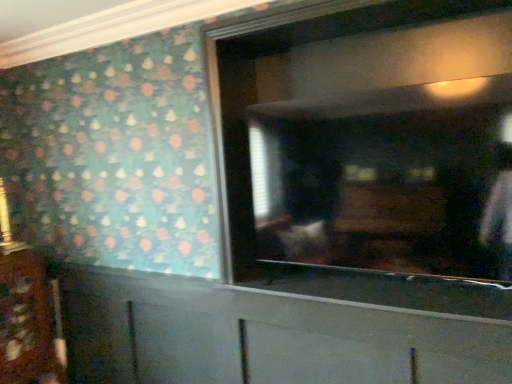
What do you see at coordinates (263, 335) in the screenshot? I see `white matte cabinet at lower center, which is counted as the 1th cabinetry, starting from the right` at bounding box center [263, 335].

This screenshot has height=384, width=512. Describe the element at coordinates (27, 322) in the screenshot. I see `wooden cabinet at lower left, which is counted as the 1th cabinetry, starting from the left` at that location.

Find the location of a particular element. Image resolution: width=512 pixels, height=384 pixels. white matte cabinet at lower center, the second cabinetry when ordered from left to right is located at coordinates (263, 335).

Looking at this image, is wooden cabinet at lower left, marked as the second cabinetry in a right-to-left arrangement, wider than white matte cabinet at lower center, which is counted as the 1th cabinetry, starting from the right?

Indeed, wooden cabinet at lower left, marked as the second cabinetry in a right-to-left arrangement, has a greater width compared to white matte cabinet at lower center, which is counted as the 1th cabinetry, starting from the right.

Considering the sizes of objects wooden cabinet at lower left, marked as the second cabinetry in a right-to-left arrangement, and white matte cabinet at lower center, which is counted as the 1th cabinetry, starting from the right, in the image provided, who is shorter, wooden cabinet at lower left, marked as the second cabinetry in a right-to-left arrangement, or white matte cabinet at lower center, which is counted as the 1th cabinetry, starting from the right,?

Standing shorter between the two is white matte cabinet at lower center, which is counted as the 1th cabinetry, starting from the right.

Does wooden cabinet at lower left, which is counted as the 1th cabinetry, starting from the left, turn towards white matte cabinet at lower center, which is counted as the 1th cabinetry, starting from the right?

Yes, wooden cabinet at lower left, which is counted as the 1th cabinetry, starting from the left, is turned towards white matte cabinet at lower center, which is counted as the 1th cabinetry, starting from the right.

Relative to white matte cabinet at lower center, the second cabinetry when ordered from left to right, is wooden cabinet at lower left, marked as the second cabinetry in a right-to-left arrangement, in front or behind?

Visually, wooden cabinet at lower left, marked as the second cabinetry in a right-to-left arrangement, is located behind white matte cabinet at lower center, the second cabinetry when ordered from left to right.

Can you tell me how much wooden cabinet at lower left, which is counted as the 1th cabinetry, starting from the left, and matte glass mirror at center differ in facing direction?

The facing directions of wooden cabinet at lower left, which is counted as the 1th cabinetry, starting from the left, and matte glass mirror at center are 92.6 degrees apart.

Consider the image. Is wooden cabinet at lower left, which is counted as the 1th cabinetry, starting from the left, aimed at matte glass mirror at center?

Yes, wooden cabinet at lower left, which is counted as the 1th cabinetry, starting from the left, faces towards matte glass mirror at center.

Does wooden cabinet at lower left, which is counted as the 1th cabinetry, starting from the left, contain matte glass mirror at center?

That's incorrect, matte glass mirror at center is not inside wooden cabinet at lower left, which is counted as the 1th cabinetry, starting from the left.

From a real-world perspective, between wooden cabinet at lower left, which is counted as the 1th cabinetry, starting from the left, and matte glass mirror at center, who is vertically higher?

matte glass mirror at center.

Is matte glass mirror at center in front of or behind white matte cabinet at lower center, the second cabinetry when ordered from left to right, in the image?

Clearly, matte glass mirror at center is in front of white matte cabinet at lower center, the second cabinetry when ordered from left to right.

From the image's perspective, which object appears higher, matte glass mirror at center or white matte cabinet at lower center, which is counted as the 1th cabinetry, starting from the right?

matte glass mirror at center appears higher in the image.

In terms of height, does matte glass mirror at center look taller or shorter compared to white matte cabinet at lower center, the second cabinetry when ordered from left to right?

Considering their sizes, matte glass mirror at center has less height than white matte cabinet at lower center, the second cabinetry when ordered from left to right.

Which of these two, matte glass mirror at center or white matte cabinet at lower center, which is counted as the 1th cabinetry, starting from the right, is thinner?

white matte cabinet at lower center, which is counted as the 1th cabinetry, starting from the right, is thinner.

Is white matte cabinet at lower center, which is counted as the 1th cabinetry, starting from the right, to the left or to the right of matte glass mirror at center in the image?

Result: white matte cabinet at lower center, which is counted as the 1th cabinetry, starting from the right, is to the left of matte glass mirror at center.

How many degrees apart are the facing directions of white matte cabinet at lower center, which is counted as the 1th cabinetry, starting from the right, and matte glass mirror at center?

2.05 degrees separate the facing orientations of white matte cabinet at lower center, which is counted as the 1th cabinetry, starting from the right, and matte glass mirror at center.

How much distance is there between white matte cabinet at lower center, which is counted as the 1th cabinetry, starting from the right, and matte glass mirror at center?

white matte cabinet at lower center, which is counted as the 1th cabinetry, starting from the right, and matte glass mirror at center are 19.65 inches apart from each other.

Considering the sizes of white matte cabinet at lower center, the second cabinetry when ordered from left to right, and matte glass mirror at center in the image, is white matte cabinet at lower center, the second cabinetry when ordered from left to right, bigger or smaller than matte glass mirror at center?

In the image, white matte cabinet at lower center, the second cabinetry when ordered from left to right, appears to be larger than matte glass mirror at center.

Between matte glass mirror at center and wooden cabinet at lower left, marked as the second cabinetry in a right-to-left arrangement, which one has smaller size?

Smaller between the two is wooden cabinet at lower left, marked as the second cabinetry in a right-to-left arrangement.

From the image's perspective, which object appears higher, matte glass mirror at center or wooden cabinet at lower left, which is counted as the 1th cabinetry, starting from the left?

matte glass mirror at center, from the image's perspective.

This screenshot has height=384, width=512. What are the coordinates of `mirror located in front of the wooden cabinet at lower left, which is counted as the 1th cabinetry, starting from the left` in the screenshot? It's located at (385, 185).

Is matte glass mirror at center placed right next to wooden cabinet at lower left, marked as the second cabinetry in a right-to-left arrangement?

matte glass mirror at center and wooden cabinet at lower left, marked as the second cabinetry in a right-to-left arrangement, are clearly separated.

Does point (191, 293) come in front of point (29, 272)?

Yes, it is in front of point (29, 272).

From the image's perspective, which one is positioned lower, white matte cabinet at lower center, which is counted as the 1th cabinetry, starting from the right, or wooden cabinet at lower left, marked as the second cabinetry in a right-to-left arrangement?

white matte cabinet at lower center, which is counted as the 1th cabinetry, starting from the right, from the image's perspective.

Consider the image. Measure the distance between white matte cabinet at lower center, the second cabinetry when ordered from left to right, and wooden cabinet at lower left, marked as the second cabinetry in a right-to-left arrangement.

white matte cabinet at lower center, the second cabinetry when ordered from left to right, and wooden cabinet at lower left, marked as the second cabinetry in a right-to-left arrangement, are 28.48 inches apart from each other.

Is white matte cabinet at lower center, the second cabinetry when ordered from left to right, in front of or behind wooden cabinet at lower left, marked as the second cabinetry in a right-to-left arrangement, in the image?

white matte cabinet at lower center, the second cabinetry when ordered from left to right, is positioned closer to the viewer than wooden cabinet at lower left, marked as the second cabinetry in a right-to-left arrangement.

Find the location of a particular element. cabinetry located above the white matte cabinet at lower center, which is counted as the 1th cabinetry, starting from the right (from a real-world perspective) is located at coordinates (27, 322).

Locate an element on the screen. the 2nd cabinetry behind the matte glass mirror at center, starting your count from the anchor is located at coordinates (27, 322).

Estimate the real-world distances between objects in this image. Which object is closer to white matte cabinet at lower center, which is counted as the 1th cabinetry, starting from the right, matte glass mirror at center or wooden cabinet at lower left, which is counted as the 1th cabinetry, starting from the left?

matte glass mirror at center is positioned closer to the anchor white matte cabinet at lower center, which is counted as the 1th cabinetry, starting from the right.

In the scene shown: Looking at the image, which one is located further to wooden cabinet at lower left, which is counted as the 1th cabinetry, starting from the left, white matte cabinet at lower center, the second cabinetry when ordered from left to right, or matte glass mirror at center?

The object further to wooden cabinet at lower left, which is counted as the 1th cabinetry, starting from the left, is matte glass mirror at center.

Looking at the image, which one is located closer to white matte cabinet at lower center, which is counted as the 1th cabinetry, starting from the right, wooden cabinet at lower left, marked as the second cabinetry in a right-to-left arrangement, or matte glass mirror at center?

matte glass mirror at center is closer to white matte cabinet at lower center, which is counted as the 1th cabinetry, starting from the right.

When comparing their distances from matte glass mirror at center, does white matte cabinet at lower center, the second cabinetry when ordered from left to right, or wooden cabinet at lower left, marked as the second cabinetry in a right-to-left arrangement, seem further?

wooden cabinet at lower left, marked as the second cabinetry in a right-to-left arrangement, is further to matte glass mirror at center.

From the image, which object appears to be nearer to matte glass mirror at center, wooden cabinet at lower left, marked as the second cabinetry in a right-to-left arrangement, or white matte cabinet at lower center, the second cabinetry when ordered from left to right?

white matte cabinet at lower center, the second cabinetry when ordered from left to right, lies closer to matte glass mirror at center than the other object.

Estimate the real-world distances between objects in this image. Which object is further from wooden cabinet at lower left, marked as the second cabinetry in a right-to-left arrangement, matte glass mirror at center or white matte cabinet at lower center, which is counted as the 1th cabinetry, starting from the right?

matte glass mirror at center.

Where is `cabinetry located between wooden cabinet at lower left, which is counted as the 1th cabinetry, starting from the left, and matte glass mirror at center in the left-right direction`? This screenshot has width=512, height=384. cabinetry located between wooden cabinet at lower left, which is counted as the 1th cabinetry, starting from the left, and matte glass mirror at center in the left-right direction is located at coordinates (263, 335).